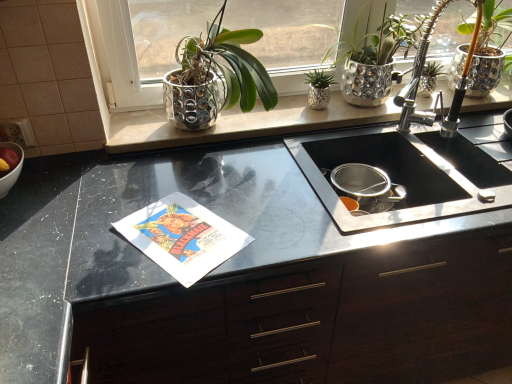
Where is `vacant area that is in front of green metallic pot at upper center, marked as the second houseplant in a right-to-left arrangement`? This screenshot has height=384, width=512. vacant area that is in front of green metallic pot at upper center, marked as the second houseplant in a right-to-left arrangement is located at coordinates (318, 119).